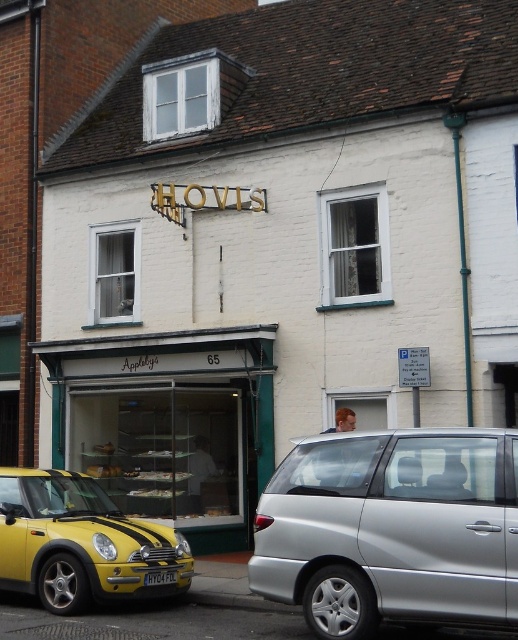
You are a delivery driver who needs to park your vehicle in front of the shop. The parking space is exactly the size of the yellow plastic license plate at lower center. Can your silver metallic van at lower right fit into this space?

The silver metallic van at lower right is larger in size than the yellow plastic license plate at lower center, so it cannot fit into the parking space that is the size of the license plate.

You are driving a car that is 5 meters long. You want to park your car between the silver metallic van at lower right and the matte glass storefront at center. Is there enough space for your car?

The distance between the silver metallic van at lower right and the matte glass storefront at center is 6.31 meters. Since your car is 5 meters long, there is enough space to park between them.

You are a delivery driver who needs to park your silver metallic van at lower right near the matte glass storefront at center. Based on the scene, can you safely park the van close to the storefront without blocking the entrance?

The silver metallic van at lower right is closer to the viewer than the matte glass storefront at center, so parking the van close to the storefront would place it in front of the entrance, potentially blocking access. Choose a different parking spot further away to ensure the entrance remains accessible.